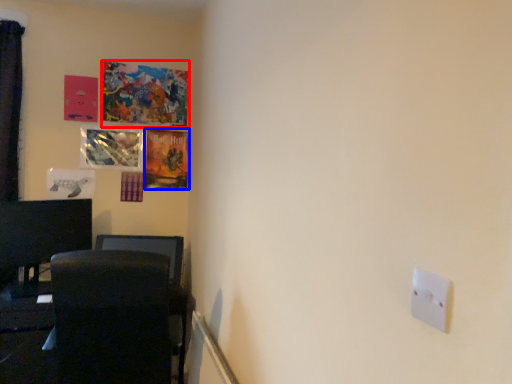
Question: Which object appears closest to the camera in this image, picture frame (highlighted by a red box) or picture frame (highlighted by a blue box)?

Choices:
 (A) picture frame
 (B) picture frame

Answer: (A)